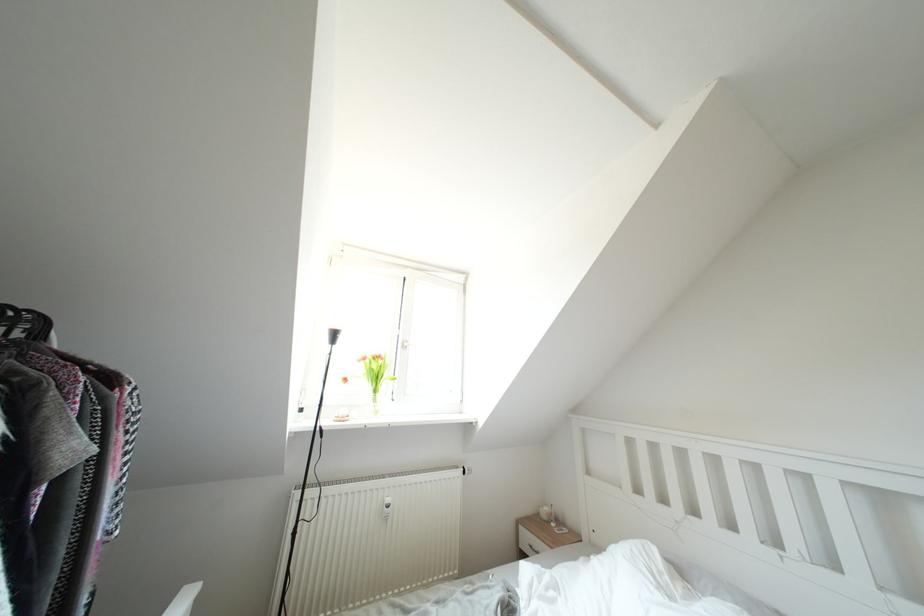
Where would you lift the glass flower vase? Please return your answer as a coordinate pair (x, y).

(374, 375)